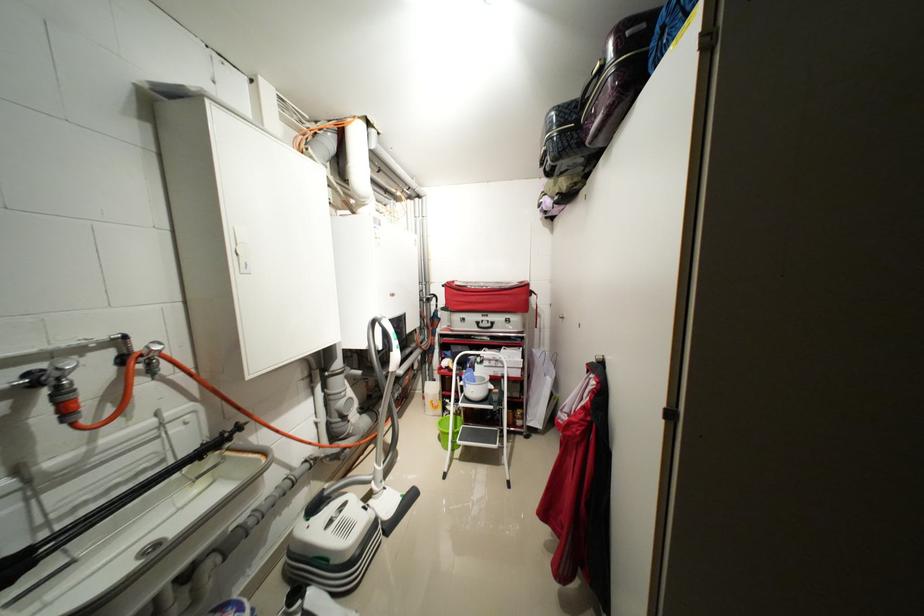
Locate an element on the screen. green bucket is located at coordinates tap(448, 430).